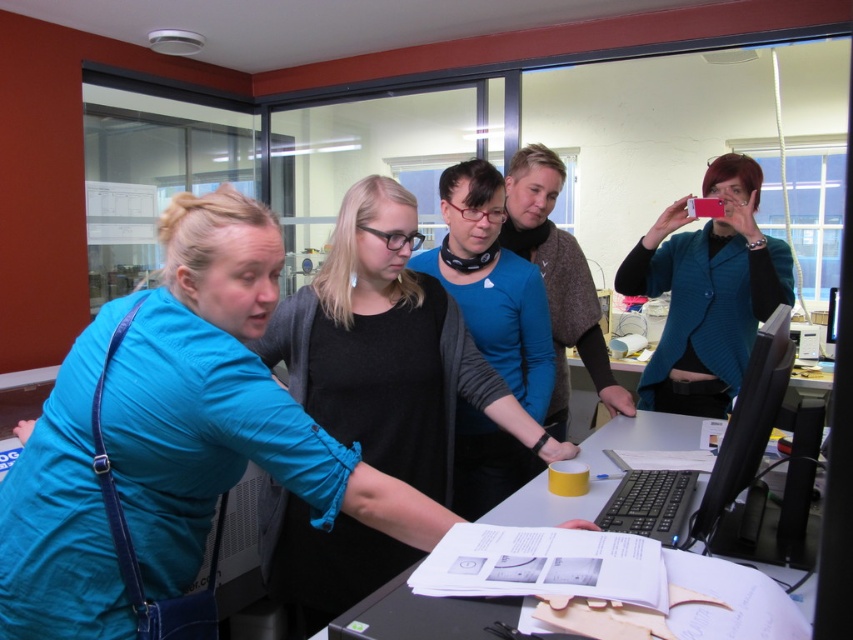
You are standing in front of the computer workstation and want to hand a document to the person wearing the blue fabric shirt at left. Based on their position, can you determine if they are positioned to the left or right side of the workstation?

The blue fabric shirt at left is located at point 0.683 on the x and 0.205 on the y, so they are positioned to the left side of the workstation.

You are standing in an office and see the blue fabric shirt at left and the black glossy monitor at right. Which object is located to the left of the other?

The blue fabric shirt at left is positioned on the left side of black glossy monitor at right.

You are organizing a meeting in an office and need to ensure there is enough space for everyone. You see the matte black shirt at center and the black glossy monitor at right. Which object takes up more horizontal space?

The matte black shirt at center takes up more horizontal space because its width is larger than the black glossy monitor at right.